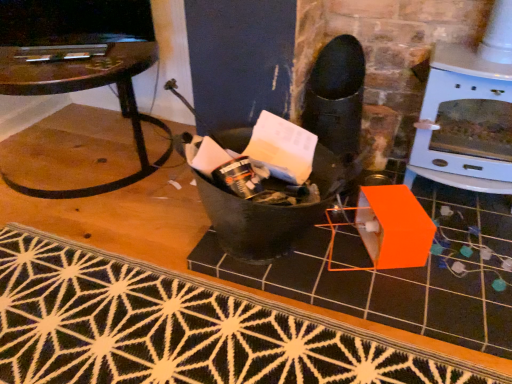
Question: Is black textured rug at lower center taller or shorter than clear glass table at left?

Choices:
 (A) short
 (B) tall

Answer: (A)

Question: From a real-world perspective, relative to clear glass table at left, is black textured rug at lower center vertically above or below?

Choices:
 (A) above
 (B) below

Answer: (B)

Question: Based on their relative distances, which object is farther from the black textured rug at lower center?

Choices:
 (A) black matte tile at center
 (B) white glossy fireplace at upper right
 (C) clear glass table at left

Answer: (B)

Question: Estimate the real-world distances between objects in this image. Which object is farther from the black textured rug at lower center?

Choices:
 (A) clear glass table at left
 (B) black matte tile at center
 (C) white glossy fireplace at upper right

Answer: (C)